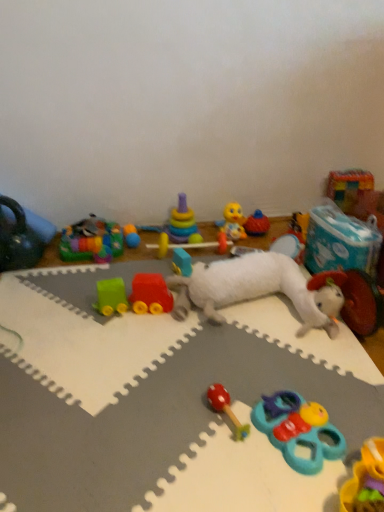
At what (x,y) coordinates should I click in order to perform the action: click on free spot above white plush toy at right, the second toy positioned from the right (from a real-world perspective). Please return your answer as a coordinate pair (x, y). Looking at the image, I should click on (350, 225).